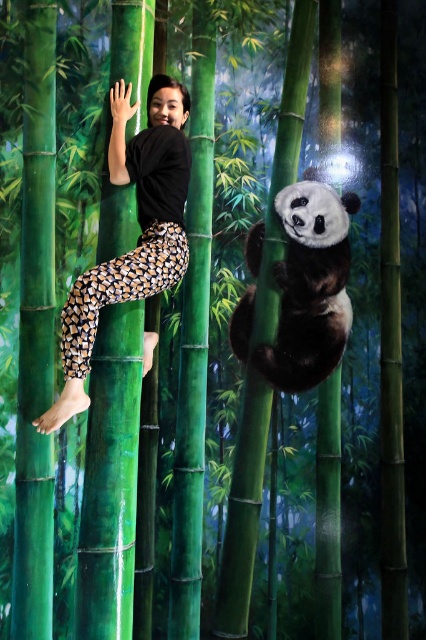
You are a photographer trying to capture a photo of the fluffy white panda at right and the black matte leggings at upper center. Which object should you focus on first if you want to include both in your frame without moving the camera?

You should focus on the fluffy white panda at right first because the black matte leggings at upper center is positioned on the left side of it, so centering the panda will allow the leggings to be included in the frame as well.

You are a photographer trying to capture the scene of the black matte leggings at upper center and the fluffy white panda at right. Which object should you focus on first if you want to highlight the larger one in your photo?

You should focus on the black matte leggings at upper center first since it has a larger size compared to the fluffy white panda at right.